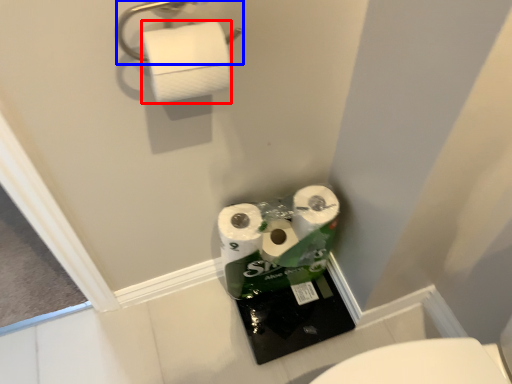
Question: Which object appears closest to the camera in this image, toilet paper (highlighted by a red box) or towel bar (highlighted by a blue box)?

Choices:
 (A) toilet paper
 (B) towel bar

Answer: (B)